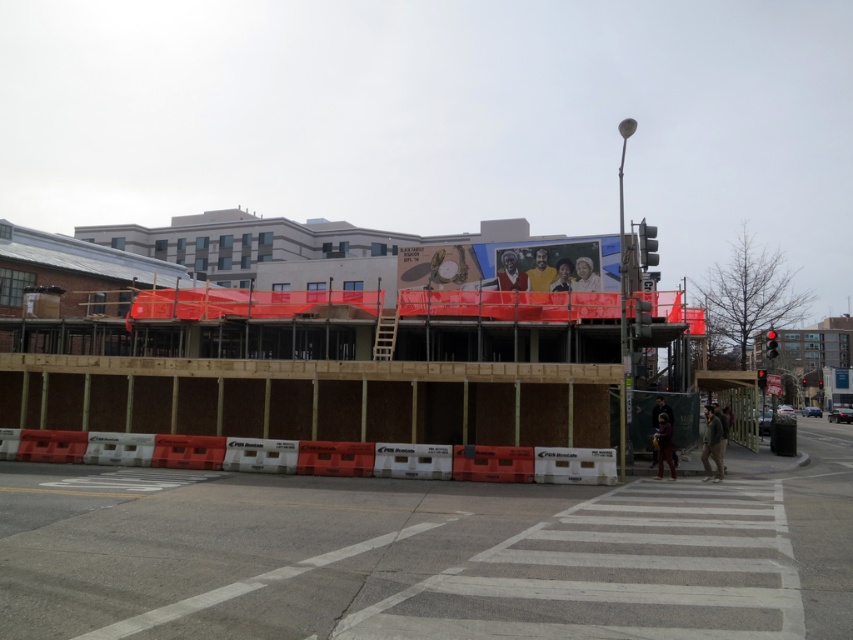
You are a delivery driver needing to pass through the construction site. You see the white plastic barricade at lower center and the red glass traffic light at center. Which object is wider?

The white plastic barricade at lower center is wider than the red glass traffic light at center.